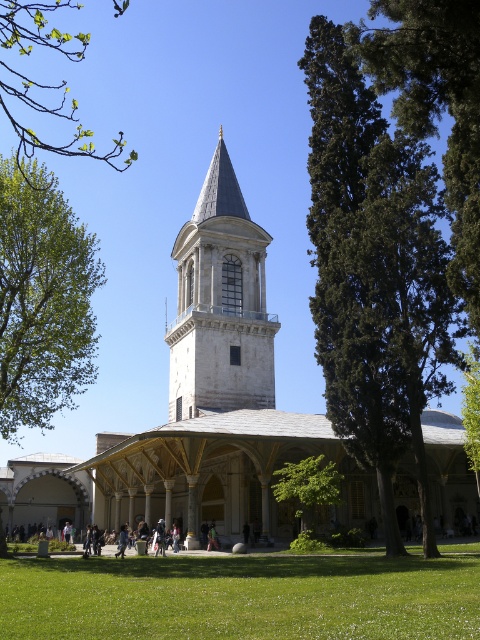
Question: Which of the following is the closest to the observer?

Choices:
 (A) white stone tower at center
 (B) green leafy tree at upper right
 (C) white stone bell tower at center
 (D) green grass at lower center

Answer: (B)

Question: Where is green leafy tree at lower center located in relation to green leafy tree at lower right in the image?

Choices:
 (A) left
 (B) right

Answer: (A)

Question: Can you confirm if green leafy tree at upper right is positioned to the right of green leafy tree at lower center?

Choices:
 (A) yes
 (B) no

Answer: (A)

Question: Does dark green coniferous tree at center come behind green grass at lower center?

Choices:
 (A) yes
 (B) no

Answer: (A)

Question: Which point is closer to the camera?

Choices:
 (A) green leafy tree at upper right
 (B) white stone bell tower at center
 (C) green leafy tree at lower right
 (D) green leafy tree at lower center

Answer: (A)

Question: Among these objects, which one is farthest from the camera?

Choices:
 (A) white stone tower at center
 (B) green leafy tree at lower center
 (C) green grass at lower center
 (D) green leafy branch at upper left

Answer: (B)